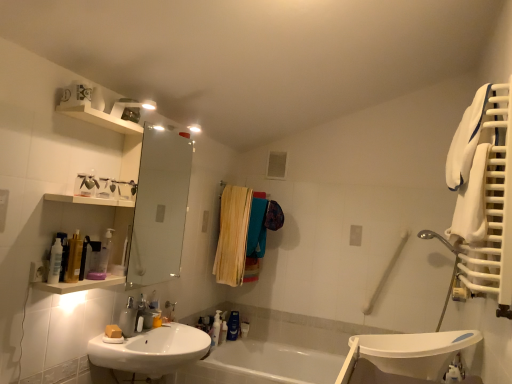
This screenshot has width=512, height=384. In order to click on vacant region to the right of blue glossy bottle at lower center, placed as the 1th toiletry when sorted from right to left in this screenshot , I will do `click(251, 336)`.